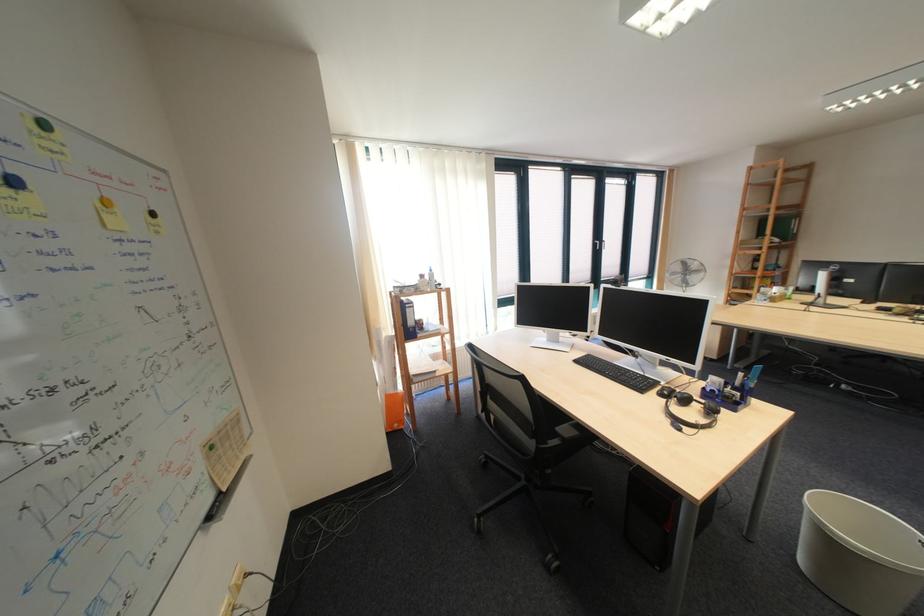
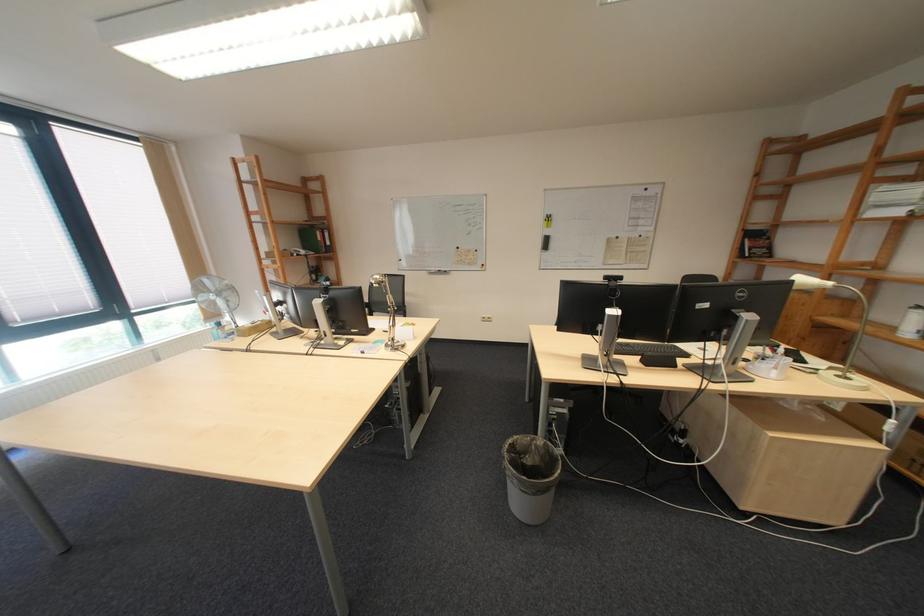
The point at (x=771, y=225) is marked in the first image. Where is the corresponding point in the second image?

(310, 233)